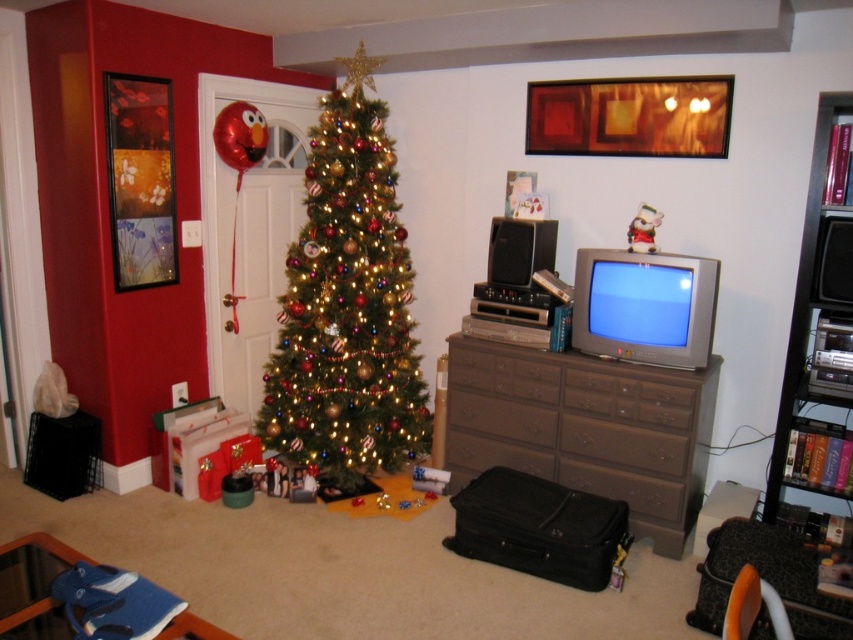
Does shiny gold christmas tree at center have a lesser width compared to brown matte dresser at center?

Yes, shiny gold christmas tree at center is thinner than brown matte dresser at center.

The image size is (853, 640). Find the location of `shiny gold christmas tree at center`. shiny gold christmas tree at center is located at coordinates (347, 305).

Does shiny gold christmas tree at center appear on the left side of white glossy santa at upper center?

Yes, shiny gold christmas tree at center is to the left of white glossy santa at upper center.

Between shiny gold christmas tree at center and white glossy santa at upper center, which one is positioned lower?

shiny gold christmas tree at center is below.

Is point (346, 481) positioned in front of point (647, 246)?

No, it is not.

The width and height of the screenshot is (853, 640). Identify the location of shiny gold christmas tree at center. (347, 305).

Does brown matte dresser at center have a greater height compared to white glossy santa at upper center?

Correct, brown matte dresser at center is much taller as white glossy santa at upper center.

Between point (656, 376) and point (651, 218), which one is positioned behind?

Positioned behind is point (651, 218).

Which is behind, point (480, 460) or point (642, 241)?

Positioned behind is point (480, 460).

I want to click on brown matte dresser at center, so click(585, 428).